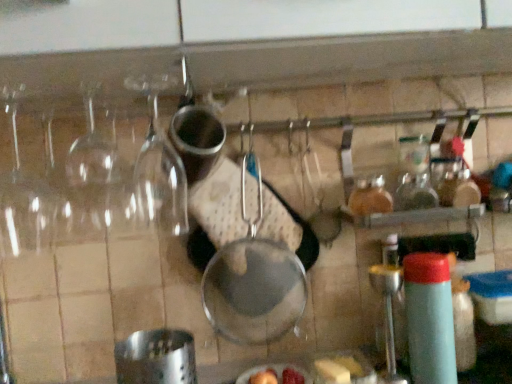
Question: Considering the relative sizes of yellow butter at lower right and light blue plastic bottle at right in the image provided, is yellow butter at lower right bigger than light blue plastic bottle at right?

Choices:
 (A) yes
 (B) no

Answer: (B)

Question: From a real-world perspective, does yellow butter at lower right sit lower than light blue plastic bottle at right?

Choices:
 (A) no
 (B) yes

Answer: (B)

Question: Does yellow butter at lower right appear on the left side of light blue plastic bottle at right?

Choices:
 (A) no
 (B) yes

Answer: (B)

Question: Could you tell me if yellow butter at lower right is turned towards light blue plastic bottle at right?

Choices:
 (A) no
 (B) yes

Answer: (A)

Question: Is yellow butter at lower right behind light blue plastic bottle at right?

Choices:
 (A) yes
 (B) no

Answer: (A)

Question: Relative to metallic silver frying pan at center, is yellow butter at lower right in front or behind?

Choices:
 (A) behind
 (B) front

Answer: (B)

Question: Considering the positions of yellow butter at lower right and metallic silver frying pan at center in the image, is yellow butter at lower right bigger or smaller than metallic silver frying pan at center?

Choices:
 (A) big
 (B) small

Answer: (B)

Question: Is yellow butter at lower right situated inside metallic silver frying pan at center or outside?

Choices:
 (A) outside
 (B) inside

Answer: (A)

Question: Looking at their shapes, would you say yellow butter at lower right is wider or thinner than metallic silver frying pan at center?

Choices:
 (A) thin
 (B) wide

Answer: (B)

Question: Visually, is metallic silver frying pan at center positioned to the left or to the right of light blue plastic bottle at right?

Choices:
 (A) left
 (B) right

Answer: (A)

Question: Looking at the image, does metallic silver frying pan at center seem bigger or smaller compared to light blue plastic bottle at right?

Choices:
 (A) big
 (B) small

Answer: (A)

Question: Considering the positions of point (243, 261) and point (448, 347), is point (243, 261) closer or farther from the camera than point (448, 347)?

Choices:
 (A) closer
 (B) farther

Answer: (B)

Question: From their relative heights in the image, would you say metallic silver frying pan at center is taller or shorter than light blue plastic bottle at right?

Choices:
 (A) short
 (B) tall

Answer: (B)

Question: Does point (411, 344) appear closer or farther from the camera than point (298, 299)?

Choices:
 (A) farther
 (B) closer

Answer: (B)

Question: Considering the relative positions of light blue plastic bottle at right and metallic silver frying pan at center in the image provided, is light blue plastic bottle at right to the left or to the right of metallic silver frying pan at center?

Choices:
 (A) left
 (B) right

Answer: (B)